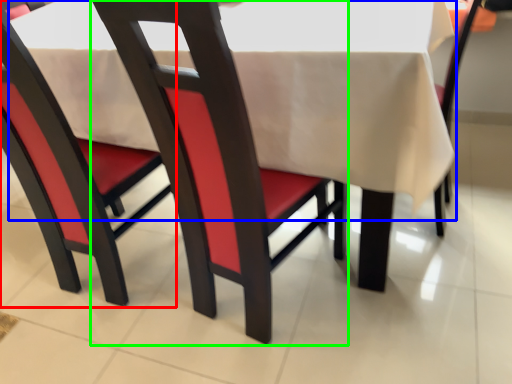
Question: Considering the real-world distances, which object is farthest from chair (highlighted by a red box)? tablecloth (highlighted by a blue box) or chair (highlighted by a green box)?

Choices:
 (A) tablecloth
 (B) chair

Answer: (B)